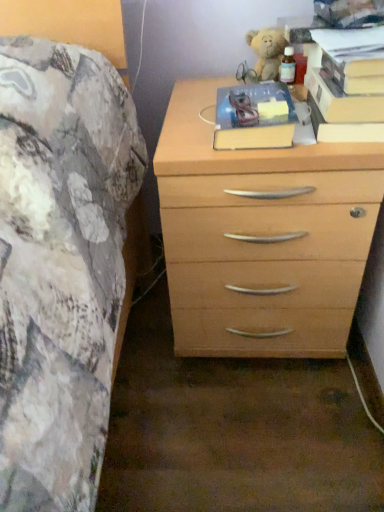
Identify the location of vacant space in front of light wood chest of drawers at right. The height and width of the screenshot is (512, 384). (249, 434).